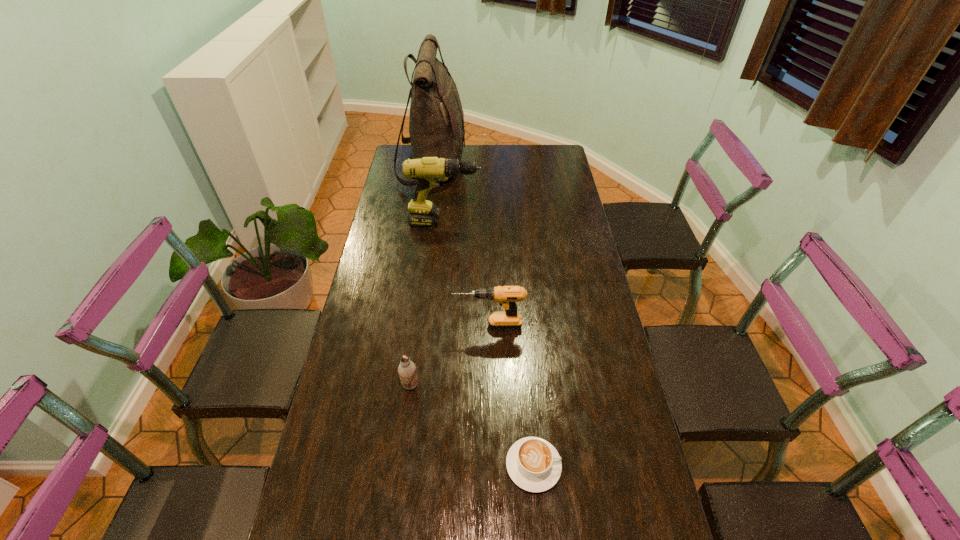
Identify the location of the farthest object. (436, 121).

This screenshot has width=960, height=540. In order to click on backpack in this screenshot , I will do `click(436, 121)`.

The image size is (960, 540). What are the coordinates of `the taller drill` in the screenshot? It's located at (428, 171).

Locate an element on the screen. The width and height of the screenshot is (960, 540). the fourth nearest object is located at coordinates (428, 171).

This screenshot has width=960, height=540. In order to click on the third tallest object in this screenshot , I will do `click(507, 296)`.

This screenshot has height=540, width=960. Identify the location of the third farthest object. (507, 296).

Locate an element on the screen. the second shortest object is located at coordinates (407, 370).

Identify the location of the fourth farthest object. Image resolution: width=960 pixels, height=540 pixels. (407, 370).

The image size is (960, 540). I want to click on the shortest object, so click(533, 464).

What are the coordinates of `cappuccino` in the screenshot? It's located at [533, 464].